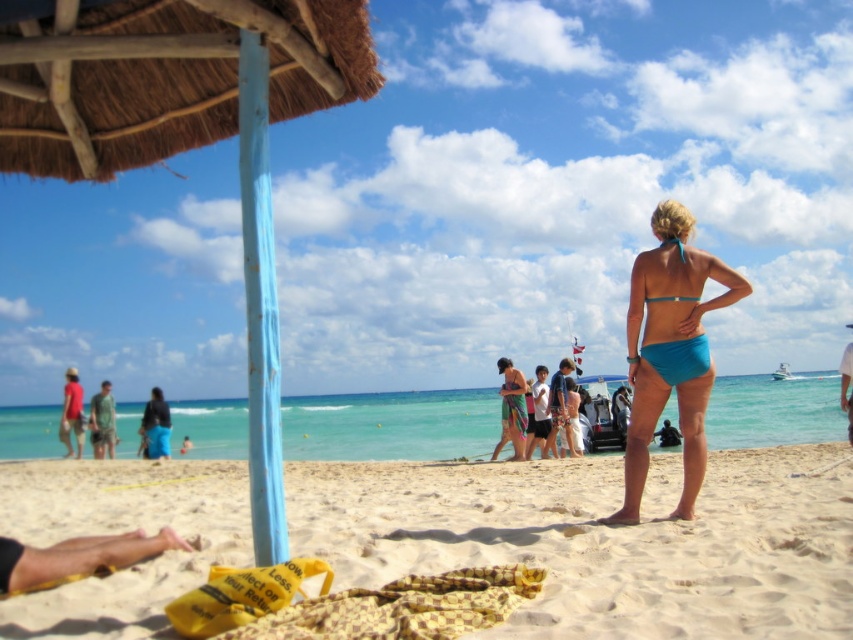
Question: Which point appears closest to the camera in this image?

Choices:
 (A) (164, 445)
 (B) (96, 435)
 (C) (555, 396)

Answer: (C)

Question: Is green fabric shorts at lower left bigger than white cotton shirt at center?

Choices:
 (A) no
 (B) yes

Answer: (B)

Question: Which point is farther to the camera?

Choices:
 (A) teal matte bikini at center
 (B) white cotton shirt at center
 (C) green fabric shorts at lower left
 (D) beige sand at center

Answer: (C)

Question: Which of the following is the farthest from the observer?

Choices:
 (A) [575, 452]
 (B) [78, 416]

Answer: (B)

Question: Can you confirm if sandy yellow at lower center is positioned to the right of white cotton shirt at center?

Choices:
 (A) yes
 (B) no

Answer: (B)

Question: Is matte red shirt at left above white cotton shirt at center?

Choices:
 (A) no
 (B) yes

Answer: (A)